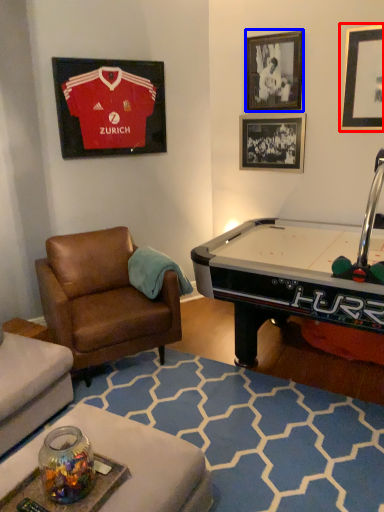
Question: Which object appears farthest to the camera in this image, picture frame (highlighted by a red box) or picture frame (highlighted by a blue box)?

Choices:
 (A) picture frame
 (B) picture frame

Answer: (B)